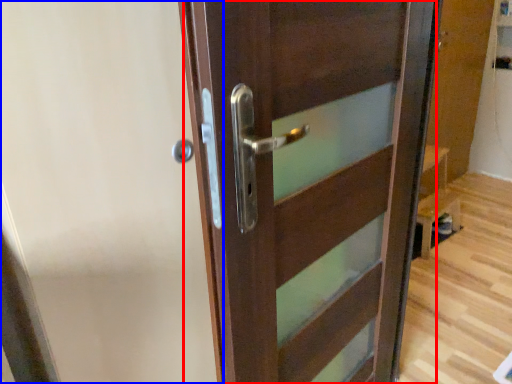
Question: Which object appears closest to the camera in this image, door (highlighted by a red box) or screen door (highlighted by a blue box)?

Choices:
 (A) door
 (B) screen door

Answer: (A)